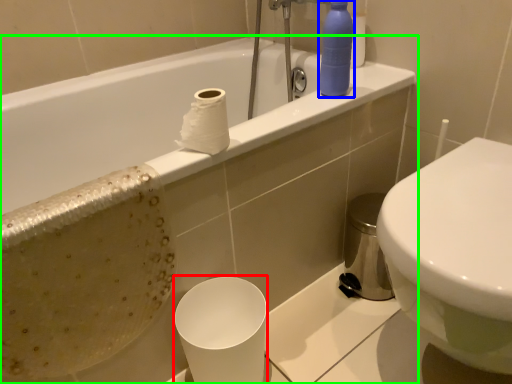
Question: Based on their relative distances, which object is nearer to paper cup (highlighted by a red box)? Choose from cleaning product (highlighted by a blue box) and bathtub (highlighted by a green box).

Choices:
 (A) cleaning product
 (B) bathtub

Answer: (B)